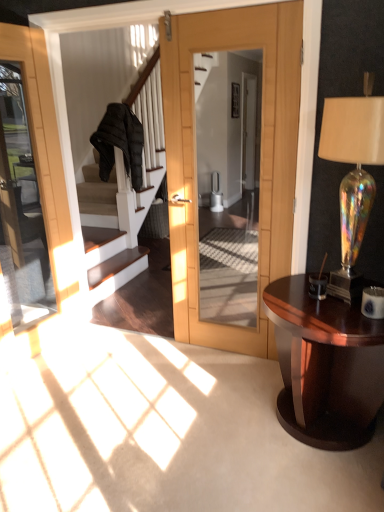
The image size is (384, 512). I want to click on glossy wood table at lower right, so click(x=325, y=366).

What do you see at coordinates (325, 366) in the screenshot? This screenshot has width=384, height=512. I see `glossy wood table at lower right` at bounding box center [325, 366].

This screenshot has height=512, width=384. In order to click on iridescent glass lamp at right in this screenshot , I will do `click(353, 174)`.

The width and height of the screenshot is (384, 512). What do you see at coordinates (353, 174) in the screenshot?
I see `iridescent glass lamp at right` at bounding box center [353, 174].

The height and width of the screenshot is (512, 384). Find the location of `glossy wood table at lower right`. glossy wood table at lower right is located at coordinates (325, 366).

From the picture: In the image, is iridescent glass lamp at right on the left side or the right side of glossy wood table at lower right?

Clearly, iridescent glass lamp at right is on the right of glossy wood table at lower right in the image.

Considering the relative positions of iridescent glass lamp at right and glossy wood table at lower right in the image provided, is iridescent glass lamp at right behind glossy wood table at lower right?

Result: No, it is not.

Is point (351, 114) less distant than point (293, 283)?

Yes, it is in front of point (293, 283).

From the image's perspective, which one is positioned higher, iridescent glass lamp at right or glossy wood table at lower right?

From the image's view, iridescent glass lamp at right is above.

From a real-world perspective, is iridescent glass lamp at right physically below glossy wood table at lower right?

No.

Is iridescent glass lamp at right thinner than glossy wood table at lower right?

Indeed, iridescent glass lamp at right has a lesser width compared to glossy wood table at lower right.

Considering the relative sizes of iridescent glass lamp at right and glossy wood table at lower right in the image provided, is iridescent glass lamp at right taller than glossy wood table at lower right?

Yes, iridescent glass lamp at right is taller than glossy wood table at lower right.

Who is bigger, iridescent glass lamp at right or glossy wood table at lower right?

With larger size is glossy wood table at lower right.

Could glossy wood table at lower right be considered to be inside iridescent glass lamp at right?

No, glossy wood table at lower right is not a part of iridescent glass lamp at right.

Is iridescent glass lamp at right far from glossy wood table at lower right?

No, iridescent glass lamp at right is not far away from glossy wood table at lower right.

Is iridescent glass lamp at right aimed at glossy wood table at lower right?

No, iridescent glass lamp at right does not turn towards glossy wood table at lower right.

How different are the orientations of iridescent glass lamp at right and glossy wood table at lower right in degrees?

The angular difference between iridescent glass lamp at right and glossy wood table at lower right is 0.741 degrees.

How much distance is there between iridescent glass lamp at right and glossy wood table at lower right?

A distance of 40.17 centimeters exists between iridescent glass lamp at right and glossy wood table at lower right.

This screenshot has width=384, height=512. In the image, there is a glossy wood table at lower right. In order to click on lamp above it (from the image's perspective) in this screenshot , I will do `click(353, 174)`.

Between glossy wood table at lower right and iridescent glass lamp at right, which one appears on the left side from the viewer's perspective?

Positioned to the left is glossy wood table at lower right.

Consider the image. Is glossy wood table at lower right closer to camera compared to iridescent glass lamp at right?

That is False.

Which point is more distant from viewer, (270,315) or (330,281)?

The point (270,315) is behind.

From the image's perspective, is glossy wood table at lower right located above or below iridescent glass lamp at right?

glossy wood table at lower right is situated lower than iridescent glass lamp at right in the image.

From the picture: From a real-world perspective, is glossy wood table at lower right positioned under iridescent glass lamp at right based on gravity?

Yes, from a real-world perspective, glossy wood table at lower right is beneath iridescent glass lamp at right.

Which of these two, glossy wood table at lower right or iridescent glass lamp at right, is thinner?

With smaller width is iridescent glass lamp at right.

From their relative heights in the image, would you say glossy wood table at lower right is taller or shorter than iridescent glass lamp at right?

Considering their sizes, glossy wood table at lower right has less height than iridescent glass lamp at right.

Is glossy wood table at lower right bigger or smaller than iridescent glass lamp at right?

Considering their sizes, glossy wood table at lower right takes up more space than iridescent glass lamp at right.

Is iridescent glass lamp at right inside glossy wood table at lower right?

Actually, iridescent glass lamp at right is outside glossy wood table at lower right.

Is glossy wood table at lower right placed right next to iridescent glass lamp at right?

There is a gap between glossy wood table at lower right and iridescent glass lamp at right.

Is glossy wood table at lower right looking in the opposite direction of iridescent glass lamp at right?

No, glossy wood table at lower right is not facing away from iridescent glass lamp at right.

The height and width of the screenshot is (512, 384). In the image, there is a glossy wood table at lower right. Identify the location of lamp above it (from the image's perspective). (353, 174).

What are the coordinates of `table on the left of iridescent glass lamp at right` in the screenshot? It's located at (325, 366).

The image size is (384, 512). What are the coordinates of `table lying below the iridescent glass lamp at right (from the image's perspective)` in the screenshot? It's located at (325, 366).